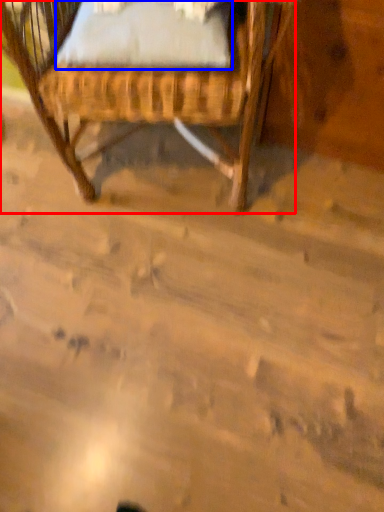
Question: Which point is further to the camera, chair (highlighted by a red box) or sheet (highlighted by a blue box)?

Choices:
 (A) chair
 (B) sheet

Answer: (B)